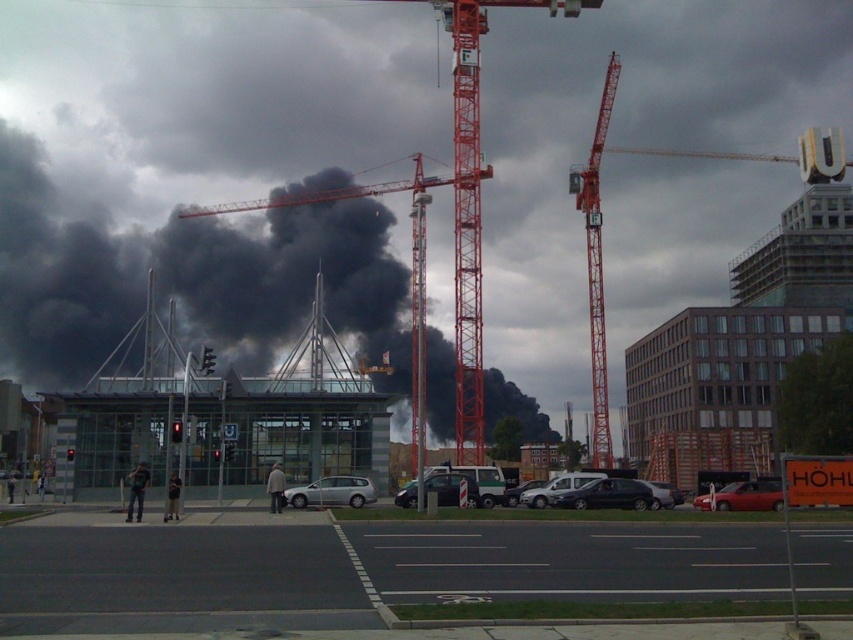
You are standing at the construction site and want to take a photo of the two points mentioned. Which point, point (16,184) or point (474,204), will appear closer to the camera in your photo?

Point (16,184) is further to the camera than point (474,204), so in the photo, point (16,184) will appear closer to the camera than point (474,204).

You are a construction worker standing at the edge of the road. You notice the black smoke at center and the red metal crane at center. Which object is positioned to the right when viewed from your perspective?

The black smoke at center is to the right of the red metal crane at center.

You are standing at the construction site and want to reach a specific point marked at coordinates point [474,67]. If your walking speed is 1.5 meters per second, how many seconds will it take you to reach that point?

The point [474,67] is 81.16 meters away from the viewer. At a walking speed of 1.5 meters per second, it will take approximately 54.1 seconds to reach the point. This is calculated by dividing the distance by the speed.